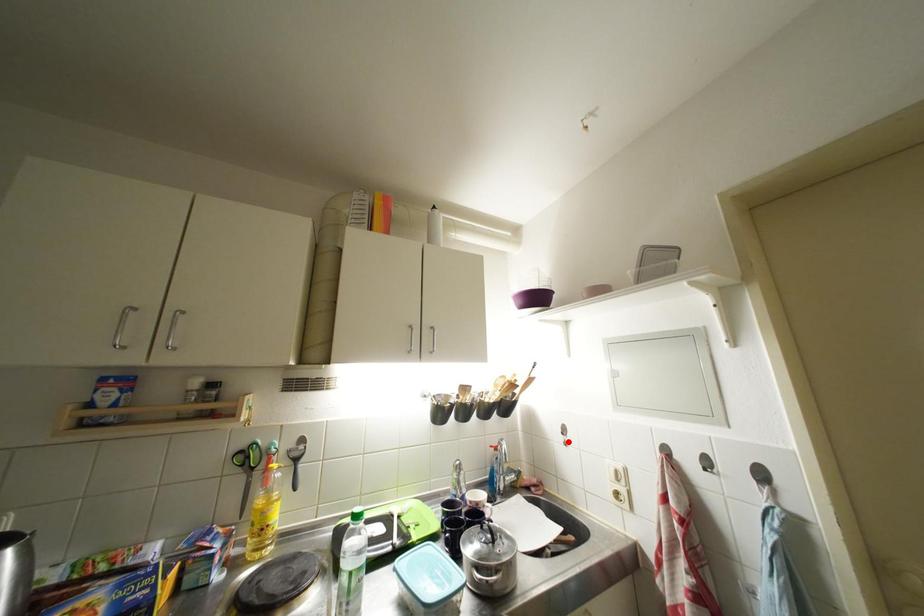
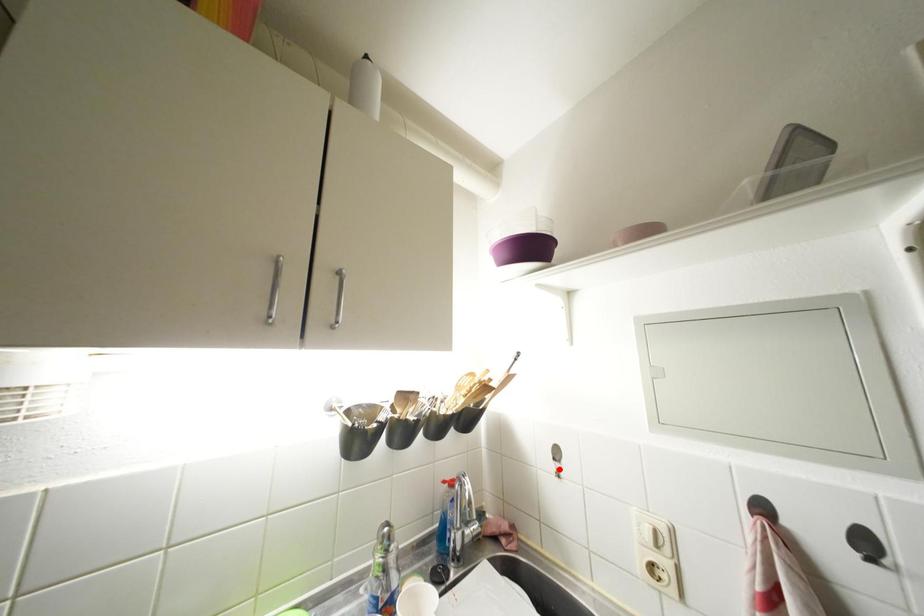
I am providing you with two images of the same scene from different viewpoints. A red point is marked on the first image and another point is marked on the second image. Is the red point in image1 aligned with the point shown in image2?

Yes